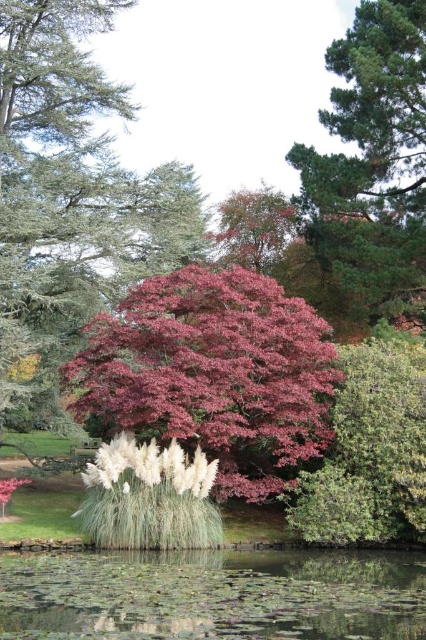
You are a gardener trying to determine which tree to prune first based on their sizes. Given the smooth green pine tree at upper right and the pink matte maple at center, which tree should you tackle first if you prioritize pruning larger trees?

The smooth green pine tree at upper right is bigger than the pink matte maple at center, so you should prune the smooth green pine tree at upper right first.

You are planning to plant a new tree in this garden scene. The pink glossy tree at center and the purple glossy maple at center are both in the same area. How far apart are these two trees?

The pink glossy tree at center and the purple glossy maple at center are 10.13 meters apart from each other.

You are standing at the center of the garden and see the point marked at coordinates (x=374, y=161). Which object in the scene does this point lie on?

The point marked at coordinates (x=374, y=161) lies on the smooth green pine tree at upper right.